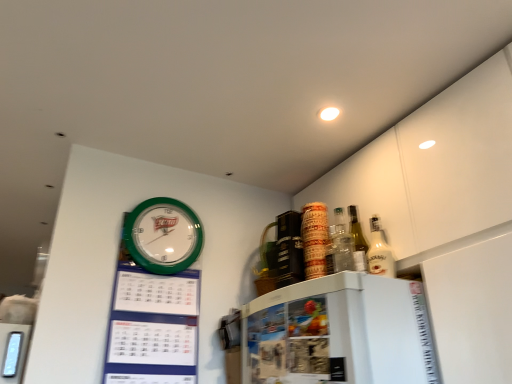
What do you see at coordinates (163, 236) in the screenshot? This screenshot has width=512, height=384. I see `green plastic wall clock at upper left` at bounding box center [163, 236].

Identify the location of white glossy bottle at upper right. (379, 252).

Find the location of a particular element. green plastic wall clock at upper left is located at coordinates (163, 236).

Which of these two, green plastic wall clock at upper left or white glossy bottle at upper right, is smaller?

white glossy bottle at upper right.

Is green plastic wall clock at upper left not inside white glossy bottle at upper right?

Yes, green plastic wall clock at upper left is located beyond the bounds of white glossy bottle at upper right.

From a real-world perspective, which object stands above the other?

green plastic wall clock at upper left.

From the picture: How many degrees apart are the facing directions of green plastic wall clock at upper left and white glossy bottle at upper right?

89 degrees separate the facing orientations of green plastic wall clock at upper left and white glossy bottle at upper right.

Which object is further away from the camera taking this photo, green plastic wall clock at upper left or green plastic calendar at upper left?

green plastic wall clock at upper left.

How many degrees apart are the facing directions of green plastic wall clock at upper left and green plastic calendar at upper left?

0.00215 degrees.

Can you confirm if green plastic wall clock at upper left is positioned to the left of green plastic calendar at upper left?

Indeed, green plastic wall clock at upper left is positioned on the left side of green plastic calendar at upper left.

Between point (147, 233) and point (196, 338), which one is positioned behind?

The point (147, 233) is farther from the camera.

Looking at their sizes, would you say green plastic calendar at upper left is wider or thinner than green plastic wall clock at upper left?

green plastic calendar at upper left is wider than green plastic wall clock at upper left.

Based on their sizes in the image, would you say green plastic calendar at upper left is bigger or smaller than green plastic wall clock at upper left?

In the image, green plastic calendar at upper left appears to be larger than green plastic wall clock at upper left.

Is green plastic calendar at upper left turned away from green plastic wall clock at upper left?

Yes, green plastic wall clock at upper left is at the back of green plastic calendar at upper left.

In terms of height, does green plastic calendar at upper left look taller or shorter compared to green plastic wall clock at upper left?

Considering their sizes, green plastic calendar at upper left has more height than green plastic wall clock at upper left.

Can you see white glossy bottle at upper right touching green plastic calendar at upper left?

There is a gap between white glossy bottle at upper right and green plastic calendar at upper left.

Locate an element on the screen. This screenshot has width=512, height=384. bulletin board located below the white glossy bottle at upper right (from the image's perspective) is located at coordinates (153, 328).

Could you tell me if white glossy bottle at upper right is turned towards green plastic calendar at upper left?

No, white glossy bottle at upper right is not oriented towards green plastic calendar at upper left.

Is green plastic calendar at upper left not near white glossy bottle at upper right?

No, green plastic calendar at upper left is in close proximity to white glossy bottle at upper right.

From a real-world perspective, who is located lower, green plastic calendar at upper left or white glossy bottle at upper right?

green plastic calendar at upper left.

Is green plastic calendar at upper left turned away from white glossy bottle at upper right?

green plastic calendar at upper left does not have its back to white glossy bottle at upper right.

Which is more to the left, white glossy bottle at upper right or green plastic wall clock at upper left?

green plastic wall clock at upper left.

Is white glossy bottle at upper right oriented towards green plastic wall clock at upper left?

No.

From the image's perspective, between white glossy bottle at upper right and green plastic wall clock at upper left, who is located below?

white glossy bottle at upper right, from the image's perspective.

This screenshot has width=512, height=384. In order to click on wall clock above the white glossy bottle at upper right (from the image's perspective) in this screenshot , I will do `click(163, 236)`.

This screenshot has height=384, width=512. In order to click on wall clock above the white glossy bottle at upper right (from a real-world perspective) in this screenshot , I will do `click(163, 236)`.

Where is `wall clock above the green plastic calendar at upper left (from the image's perspective)`? Image resolution: width=512 pixels, height=384 pixels. wall clock above the green plastic calendar at upper left (from the image's perspective) is located at coordinates (163, 236).

Looking at the image, which one is located further to white glossy bottle at upper right, green plastic wall clock at upper left or green plastic calendar at upper left?

Among the two, green plastic calendar at upper left is located further to white glossy bottle at upper right.

Looking at the image, which one is located closer to green plastic wall clock at upper left, green plastic calendar at upper left or white glossy bottle at upper right?

green plastic calendar at upper left is positioned closer to the anchor green plastic wall clock at upper left.

From the image, which object appears to be farther from green plastic wall clock at upper left, white glossy bottle at upper right or green plastic calendar at upper left?

white glossy bottle at upper right lies further to green plastic wall clock at upper left than the other object.

From the image, which object appears to be farther from green plastic calendar at upper left, green plastic wall clock at upper left or white glossy bottle at upper right?

The object further to green plastic calendar at upper left is white glossy bottle at upper right.

Based on their spatial positions, is white glossy bottle at upper right or green plastic wall clock at upper left closer to green plastic calendar at upper left?

green plastic wall clock at upper left is positioned closer to the anchor green plastic calendar at upper left.

Based on the photo, based on their spatial positions, is green plastic calendar at upper left or green plastic wall clock at upper left closer to white glossy bottle at upper right?

green plastic wall clock at upper left.

Image resolution: width=512 pixels, height=384 pixels. I want to click on bulletin board located between green plastic wall clock at upper left and white glossy bottle at upper right in the left-right direction, so click(x=153, y=328).